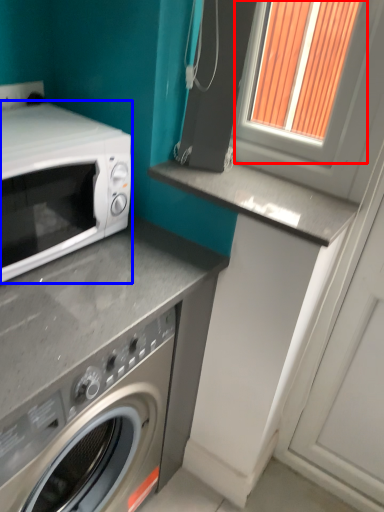
Question: Which of the following is the farthest to the observer, window frame (highlighted by a red box) or microwave oven (highlighted by a blue box)?

Choices:
 (A) window frame
 (B) microwave oven

Answer: (A)